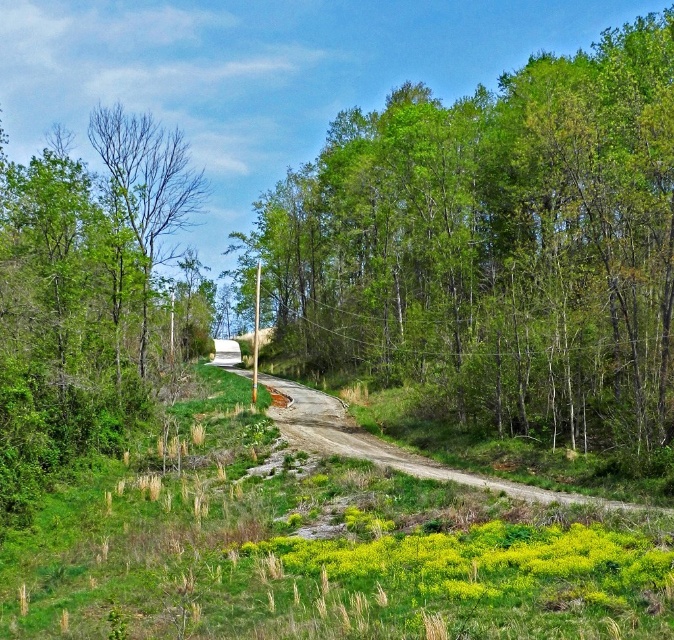
You are a hiker walking along the winding dirt road in the rural landscape. You notice a green leafy tree at center and a bare branches at left. Which of these two objects is closer to you as you walk along the road?

The green leafy tree at center is closer to you because it is positioned in front of the bare branches at left, indicating it is nearer in the scene.

You are a hiker standing on the winding dirt road and see the green leafy tree at left and the bare branches at left. Which one is more to the left?

The green leafy tree at left is more on the left side of the bare branches at left.

You are a hiker standing on the winding dirt road in the rural landscape. You notice a green leafy tree at center and a bare branches at left. Which tree would cast a longer shadow on the ground?

The green leafy tree at center is much taller than the bare branches at left, so it would cast a longer shadow on the ground.